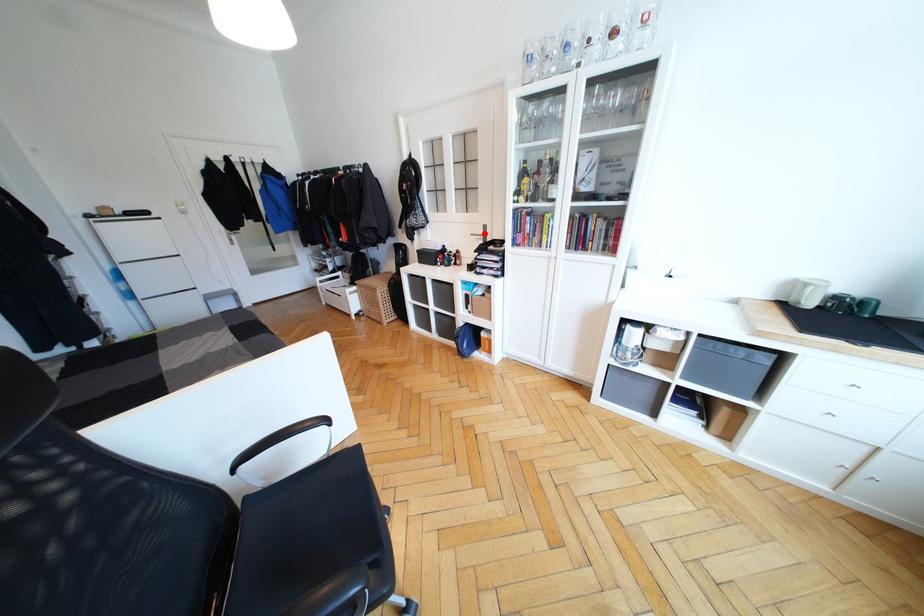
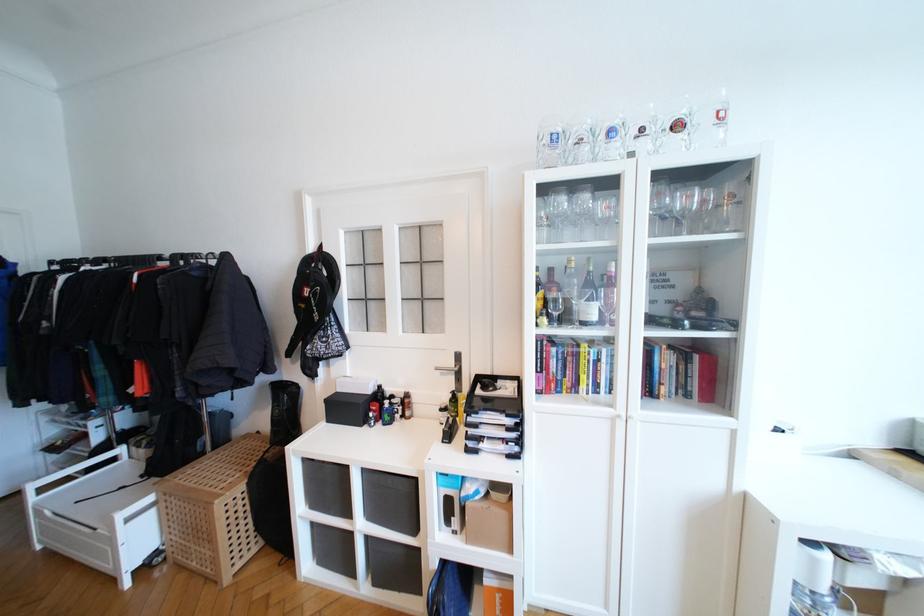
Where in the second image is the point corresponding to the highlighted location from the first image?

(455, 363)